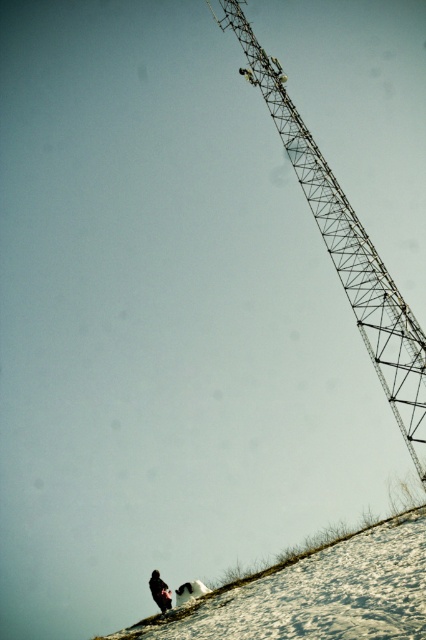
Question: Observing the image, what is the correct spatial positioning of metallic lattice crane at upper right in reference to dark fabric jacket at lower center?

Choices:
 (A) right
 (B) left

Answer: (A)

Question: Which object is farther from the camera taking this photo?

Choices:
 (A) metallic lattice crane at upper right
 (B) dark fabric jacket at lower center

Answer: (B)

Question: Which point is closer to the camera taking this photo?

Choices:
 (A) (155, 577)
 (B) (331, 193)

Answer: (A)

Question: Where is metallic lattice crane at upper right located in relation to dark fabric jacket at lower center in the image?

Choices:
 (A) below
 (B) above

Answer: (B)

Question: Does metallic lattice crane at upper right have a lesser width compared to dark fabric jacket at lower center?

Choices:
 (A) yes
 (B) no

Answer: (B)